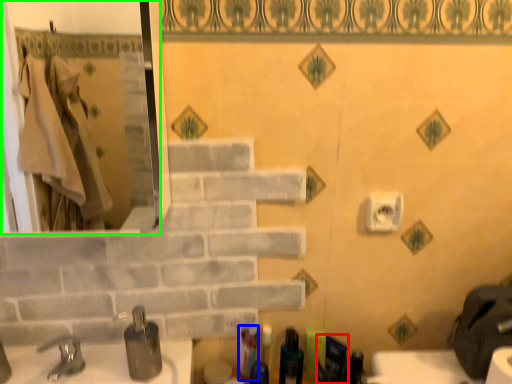
Question: Which object is the farthest from toiletry (highlighted by a red box)? Choose among these: toiletry (highlighted by a blue box) or mirror (highlighted by a green box).

Choices:
 (A) toiletry
 (B) mirror

Answer: (B)